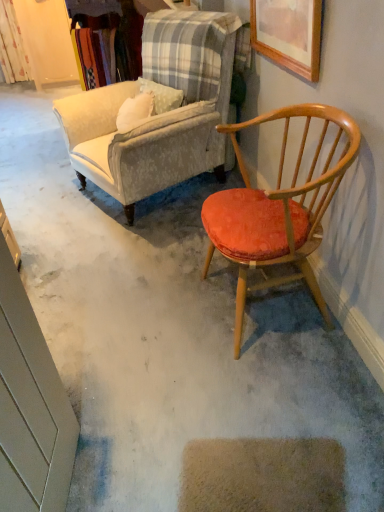
Question: In terms of size, does wooden armchair with orange cushion at right, placed as the second chair when sorted from back to front, appear bigger or smaller than velvet beige armchair at upper left, the first chair when ordered from back to front?

Choices:
 (A) small
 (B) big

Answer: (A)

Question: From the image's perspective, is wooden armchair with orange cushion at right, positioned as the 1th chair in front-to-back order, located above or below velvet beige armchair at upper left, the first chair when ordered from back to front?

Choices:
 (A) below
 (B) above

Answer: (A)

Question: Based on their relative distances, which object is nearer to the floral fabric curtain at upper left?

Choices:
 (A) wooden picture frame at upper right
 (B) velvet beige armchair at upper left, which is the 2th chair from front to back
 (C) wooden armchair with orange cushion at right, positioned as the 1th chair in front-to-back order

Answer: (B)

Question: Which object is positioned closest to the velvet beige armchair at upper left, the first chair when ordered from back to front?

Choices:
 (A) wooden picture frame at upper right
 (B) wooden armchair with orange cushion at right, positioned as the 1th chair in front-to-back order
 (C) floral fabric curtain at upper left

Answer: (A)